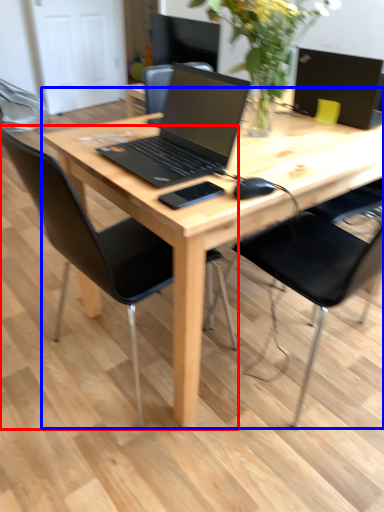
Question: Which of the following is the farthest to the observer, chair (highlighted by a red box) or desk (highlighted by a blue box)?

Choices:
 (A) chair
 (B) desk

Answer: (B)